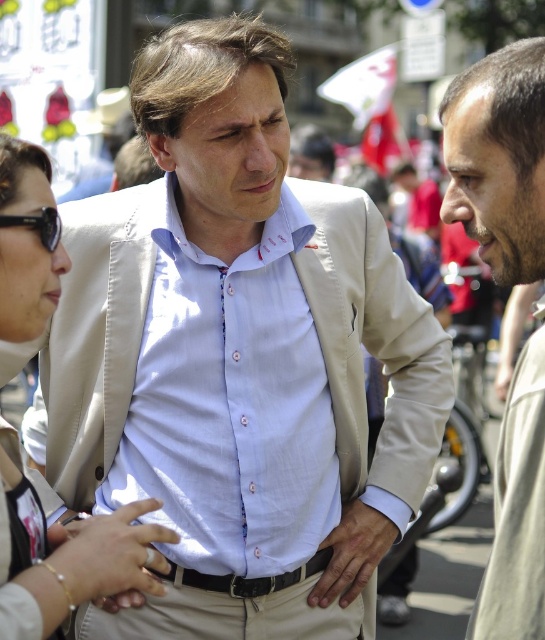
Question: Which of the following is the farthest from the observer?

Choices:
 (A) (276, 243)
 (B) (325, 600)
 (C) (118, 579)

Answer: (B)

Question: Can you confirm if beige textured jacket at right is positioned to the left of matte beige vest at center?

Choices:
 (A) yes
 (B) no

Answer: (B)

Question: Can you confirm if light blue cotton shirt at center is positioned below black plastic sunglasses at left?

Choices:
 (A) yes
 (B) no

Answer: (A)

Question: Based on their relative distances, which object is nearer to the gold bracelet at lower left?

Choices:
 (A) beige textured jacket at right
 (B) smooth beige hand at center
 (C) matte beige vest at center

Answer: (C)

Question: Which point is closer to the camera taking this photo?

Choices:
 (A) [268, 436]
 (B) [385, 548]
 (C) [540, 200]
 (D) [51, 536]

Answer: (D)

Question: From the image, what is the correct spatial relationship of matte beige vest at center in relation to smooth beige hand at center?

Choices:
 (A) below
 (B) above

Answer: (B)